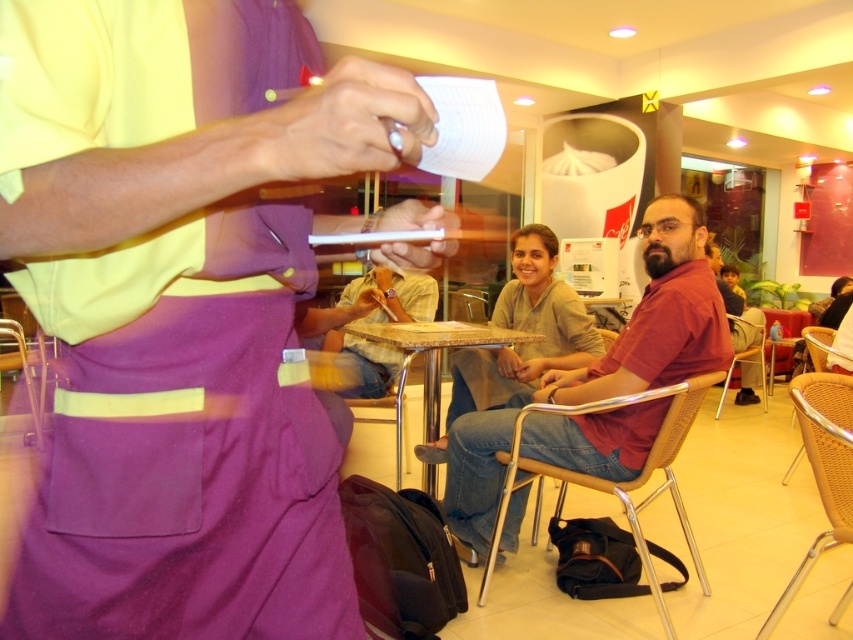
How far apart are matte red shirt at center and matte brown shirt at center?

They are 82.64 centimeters apart.

You are a GUI agent. You are given a task and a screenshot of the screen. Output one action in this format:
    pyautogui.click(x=<x>, y=<y>)
    Task: Click on the matte red shirt at center
    
    Given the screenshot: What is the action you would take?
    pyautogui.click(x=657, y=316)

Where is `matte red shirt at center`? The image size is (853, 640). matte red shirt at center is located at coordinates (657, 316).

Image resolution: width=853 pixels, height=640 pixels. Describe the element at coordinates (393, 296) in the screenshot. I see `matte brown shirt at center` at that location.

Does point (415, 320) lie in front of point (379, 328)?

No, it is behind (379, 328).

You are a GUI agent. You are given a task and a screenshot of the screen. Output one action in this format:
    pyautogui.click(x=<x>, y=<y>)
    Task: Click on the matte brown shirt at center
    The width and height of the screenshot is (853, 640).
    Given the screenshot: What is the action you would take?
    pyautogui.click(x=393, y=296)

Does matte red shirt at center have a lesser height compared to marble-patterned table at center?

Incorrect, matte red shirt at center's height does not fall short of marble-patterned table at center's.

Is matte red shirt at center to the right of marble-patterned table at center from the viewer's perspective?

Correct, you'll find matte red shirt at center to the right of marble-patterned table at center.

Is point (636, 324) positioned before point (424, 344)?

Yes, it is in front of point (424, 344).

Find the location of `matte red shirt at center`. matte red shirt at center is located at coordinates (657, 316).